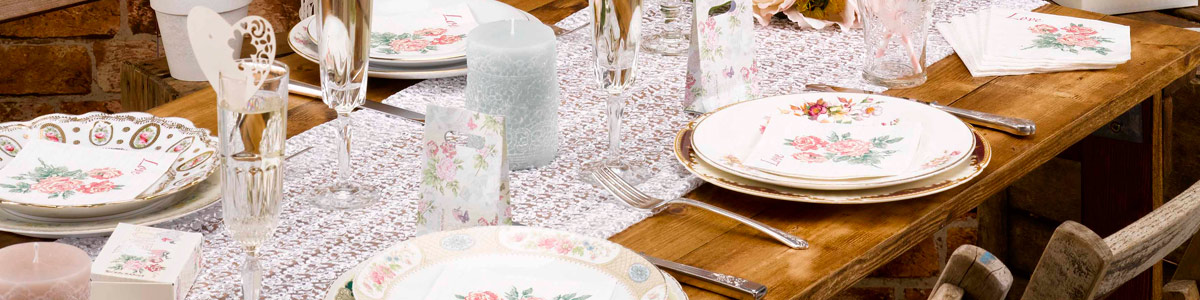
Where is `silverware`? silverware is located at coordinates pyautogui.click(x=1008, y=120), pyautogui.click(x=752, y=221), pyautogui.click(x=738, y=282), pyautogui.click(x=403, y=111).